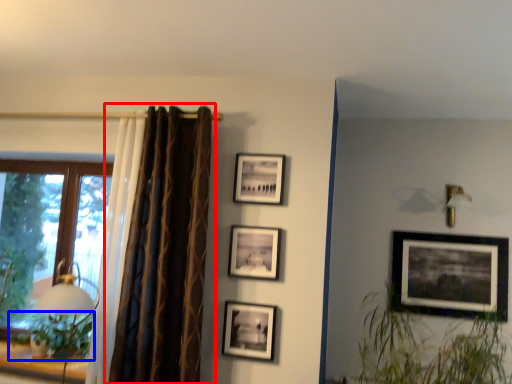
Question: Which point is further to the camera, curtain (highlighted by a red box) or plant (highlighted by a blue box)?

Choices:
 (A) curtain
 (B) plant

Answer: (B)